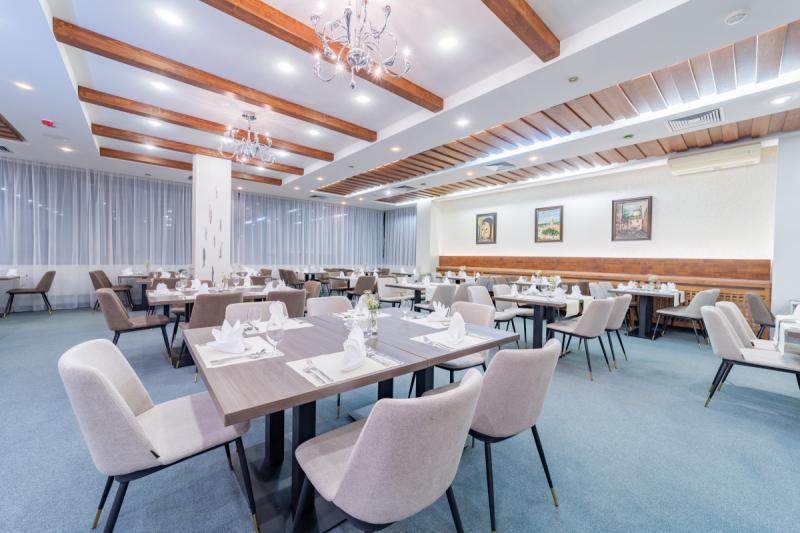
This screenshot has height=533, width=800. What are the coordinates of `vent` in the screenshot? It's located at (402, 187), (498, 164), (713, 115), (4, 150).